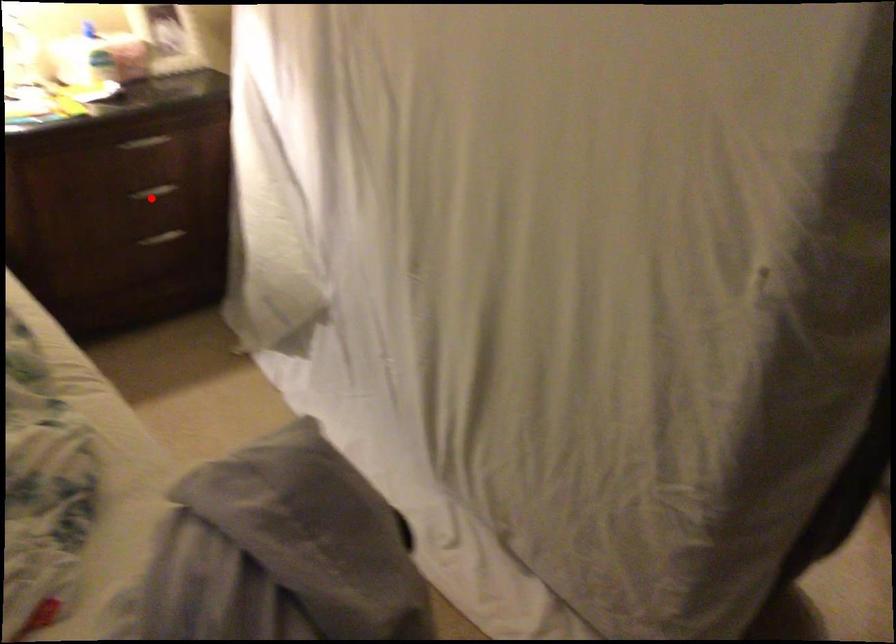
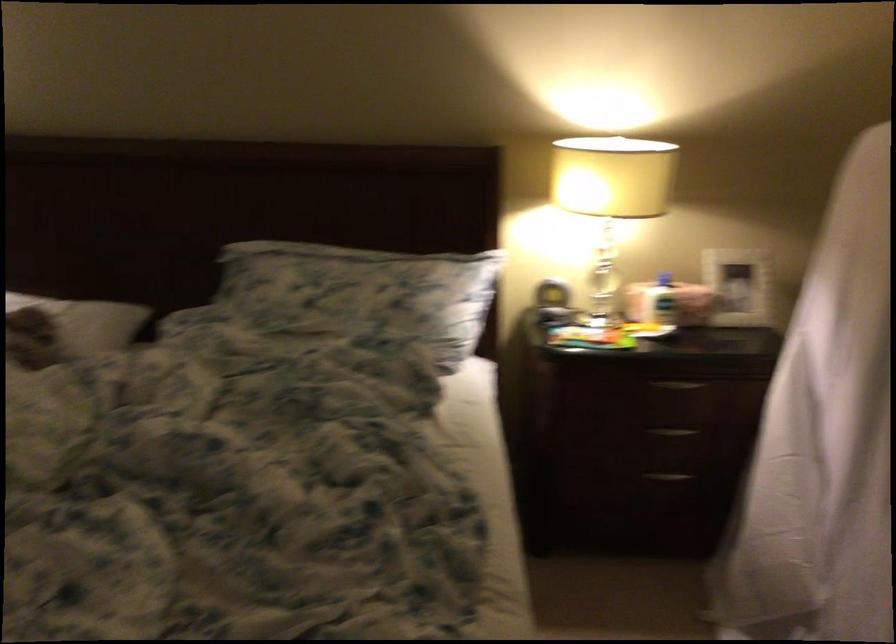
Where in the second image is the point corresponding to the highlighted location from the first image?

(672, 431)